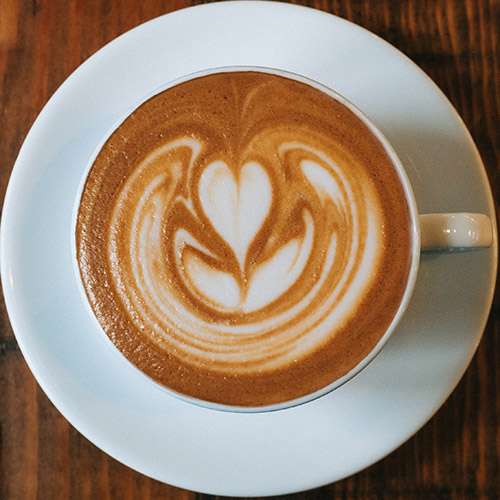
Where is `plate`? Image resolution: width=500 pixels, height=500 pixels. plate is located at coordinates (181, 39).